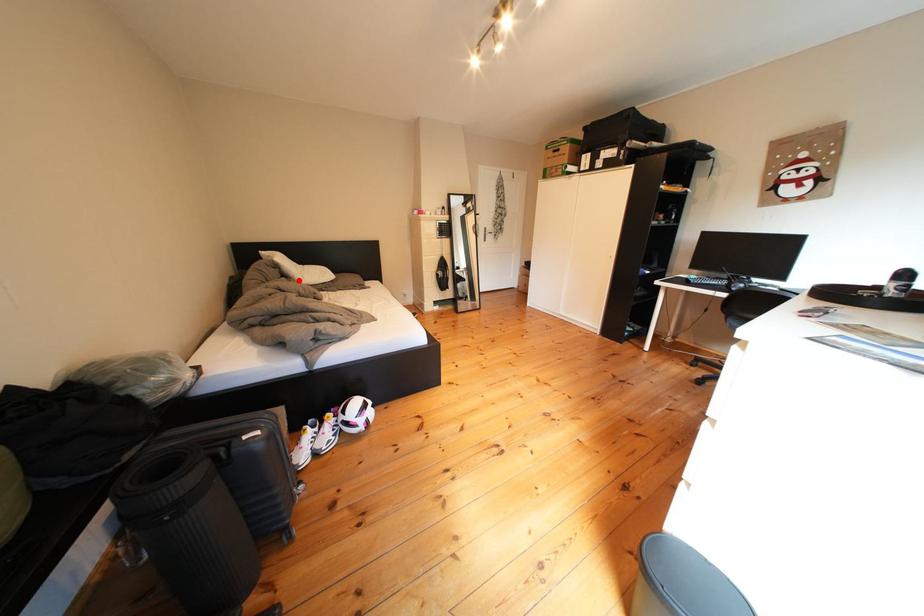
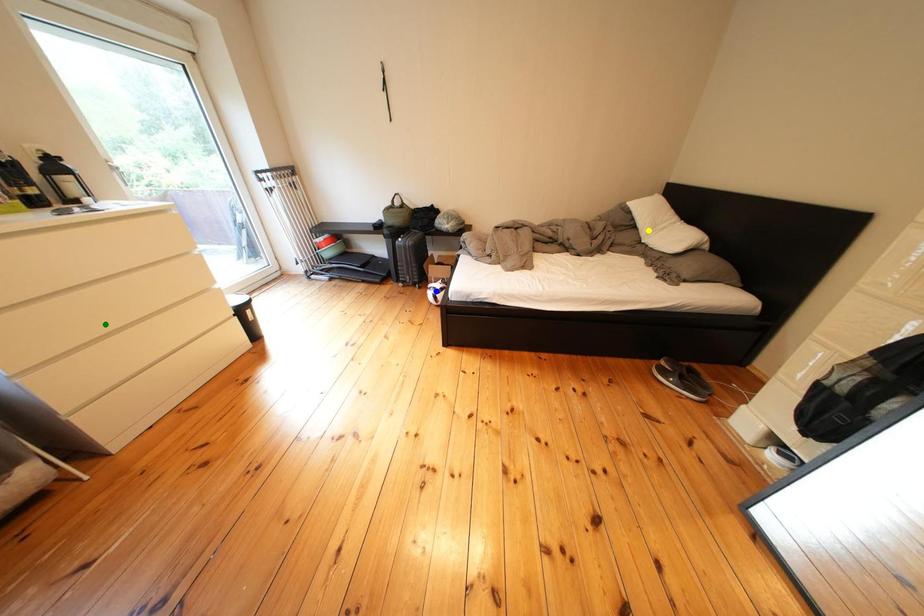
Question: I am providing you with two images of the same scene from different viewpoints. A red point is marked on the first image. You are given multiple points on the second image. Can you choose the point in image 2 that corresponds to the point in image 1?

Choices:
 (A) yellow point
 (B) green point
 (C) blue point

Answer: (A)